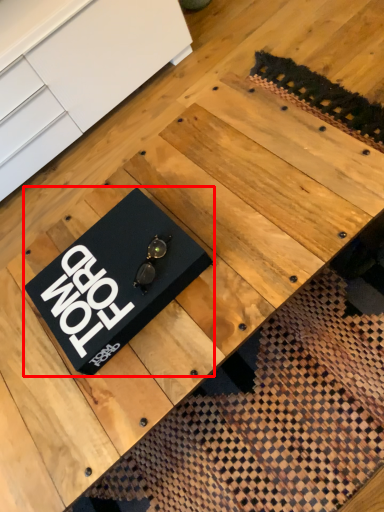
Question: Observing the image, what is the correct spatial positioning of plaque (annotated by the red box) in reference to furniture?

Choices:
 (A) right
 (B) left

Answer: (A)